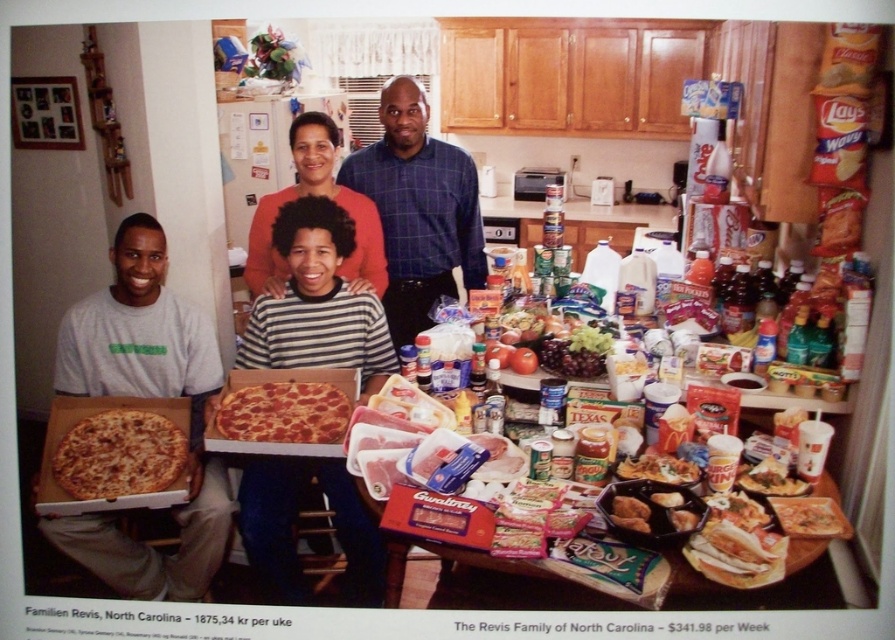
Question: Based on their relative distances, which object is nearer to the blue plaid shirt at center?

Choices:
 (A) cheesy pizza at lower left
 (B) wooden table at center
 (C) white matte shirt at lower left

Answer: (C)

Question: Estimate the real-world distances between objects in this image. Which object is closer to the wooden table at center?

Choices:
 (A) pepperoni pizza at center
 (B) matte blue shirt at center
 (C) matte orange sweater at upper center

Answer: (A)

Question: Does matte blue shirt at center appear on the right side of matte orange sweater at upper center?

Choices:
 (A) no
 (B) yes

Answer: (B)

Question: Can you confirm if blue plaid shirt at center is wider than cheesy pizza at lower left?

Choices:
 (A) yes
 (B) no

Answer: (A)

Question: Is white matte shirt at lower left above pepperoni pizza at center?

Choices:
 (A) no
 (B) yes

Answer: (A)

Question: Which point is closer to the camera taking this photo?

Choices:
 (A) (299, 173)
 (B) (380, 195)

Answer: (A)